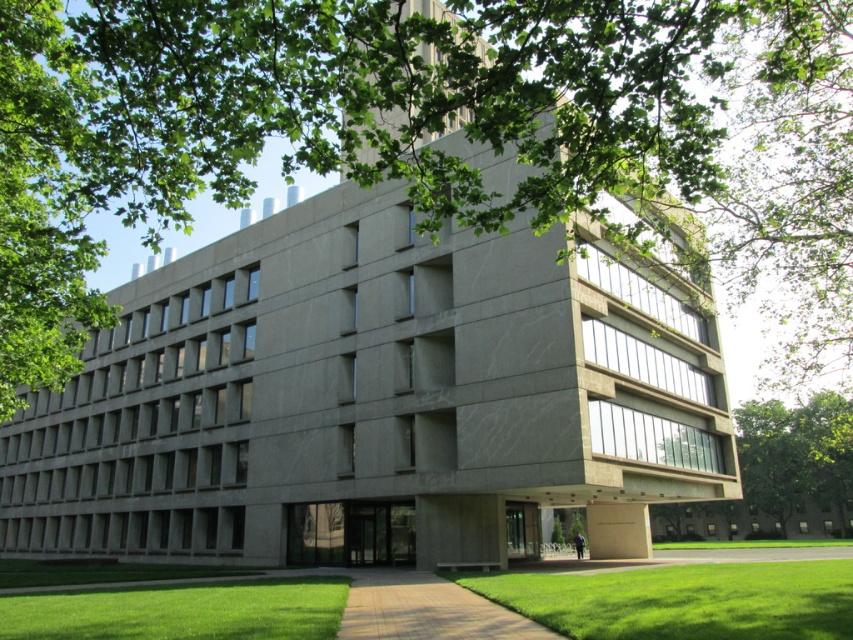
You are standing at the entrance of the building and want to take a photo of the two points mentioned. Which point, point (328,113) or point (817,481), will appear larger in your camera view?

Point (328,113) will appear larger in the camera view because it is closer to the camera than point (817,481).

You are a landscape architect planning to install a new sprinkler system. The sprinkler has a maximum range of 15 meters. Can the sprinkler at the brick paved path at center reach the green leafy tree at upper left?

The distance between the green leafy tree at upper left and the brick paved path at center is 14.75 meters, which is within the sprinkler system maximum range of 15 meters. Therefore, the sprinkler at the brick paved path at center can reach the green leafy tree at upper left.